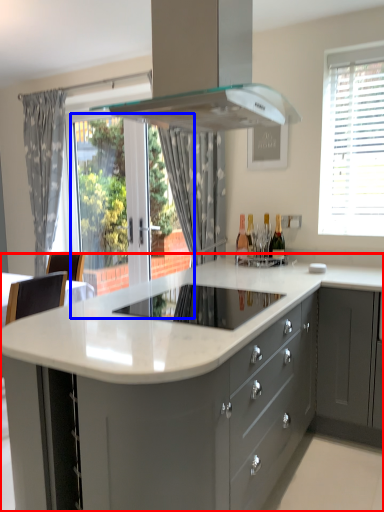
Question: Which object is closer to the camera taking this photo, countertop (highlighted by a red box) or glass door (highlighted by a blue box)?

Choices:
 (A) countertop
 (B) glass door

Answer: (A)